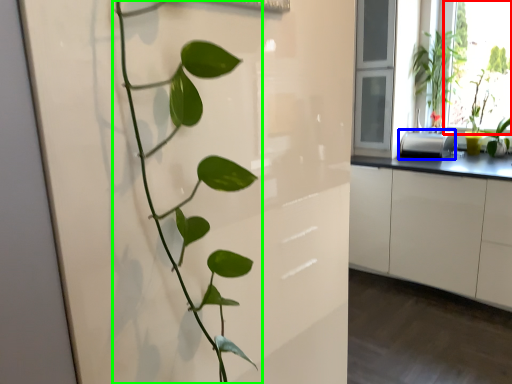
Question: Which is nearer to the window screen (highlighted by a red box)? appliance (highlighted by a blue box) or houseplant (highlighted by a green box).

Choices:
 (A) appliance
 (B) houseplant

Answer: (A)